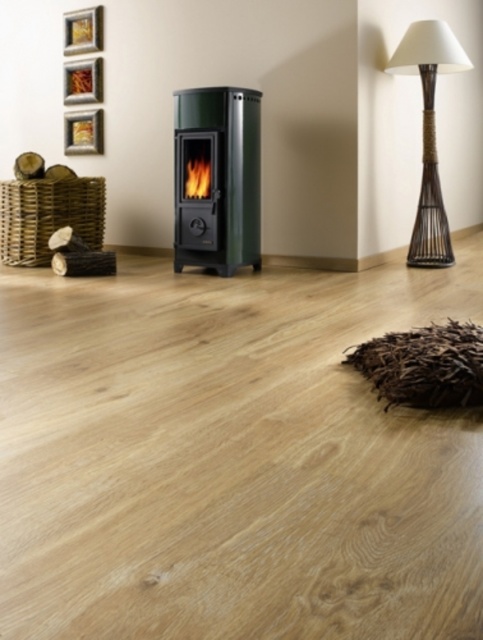
You are an interior designer assessing the placement of the woven bamboo lamp at upper right and the wooden picture frame at upper left. Which object is closer to the viewer?

The woven bamboo lamp at upper right is closer to the viewer than the wooden picture frame at upper left because it is positioned in front of it.

You have a decorative item that is 10 inches wide that you want to place between the wooden picture frame at upper left and the metallic gold picture frame at upper left. Can it fit without overlapping either of them?

The wooden picture frame at upper left and metallic gold picture frame at upper left are 9.84 inches apart from each other. Since the decorative item is 10 inches wide, it cannot fit between them without overlapping either frame.